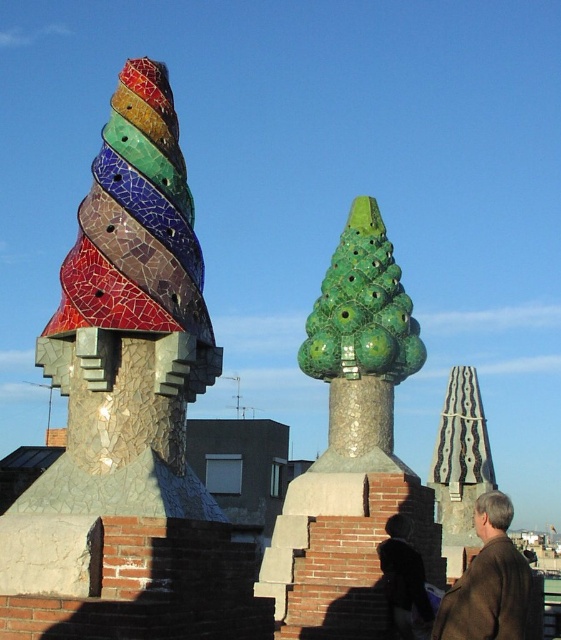
Question: Which object is the closest to the cracked mosaic chimney at left?

Choices:
 (A) brown woolen jacket at lower right
 (B) green glossy cone at center

Answer: (A)

Question: Which of the following is the closest to the observer?

Choices:
 (A) (482, 538)
 (B) (378, 420)

Answer: (A)

Question: Can you confirm if cracked mosaic chimney at left is bigger than brown woolen jacket at lower right?

Choices:
 (A) no
 (B) yes

Answer: (A)

Question: Does green glossy cone at center appear on the left side of brown woolen jacket at lower right?

Choices:
 (A) yes
 (B) no

Answer: (A)

Question: Based on their relative distances, which object is farther from the brown woolen jacket at lower right?

Choices:
 (A) green glossy cone at center
 (B) cracked mosaic chimney at left

Answer: (B)

Question: Does cracked mosaic chimney at left appear on the left side of brown woolen jacket at lower right?

Choices:
 (A) yes
 (B) no

Answer: (A)